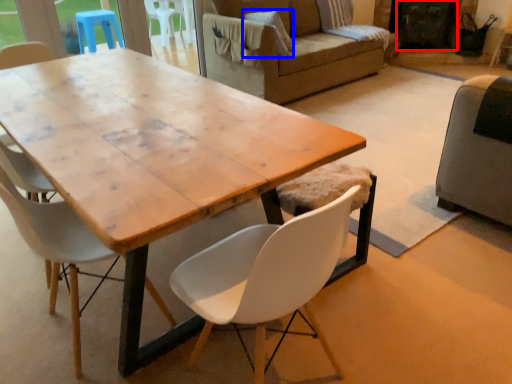
Question: Which of the following is the farthest to the observer, screen door (highlighted by a red box) or pillow (highlighted by a blue box)?

Choices:
 (A) screen door
 (B) pillow

Answer: (A)